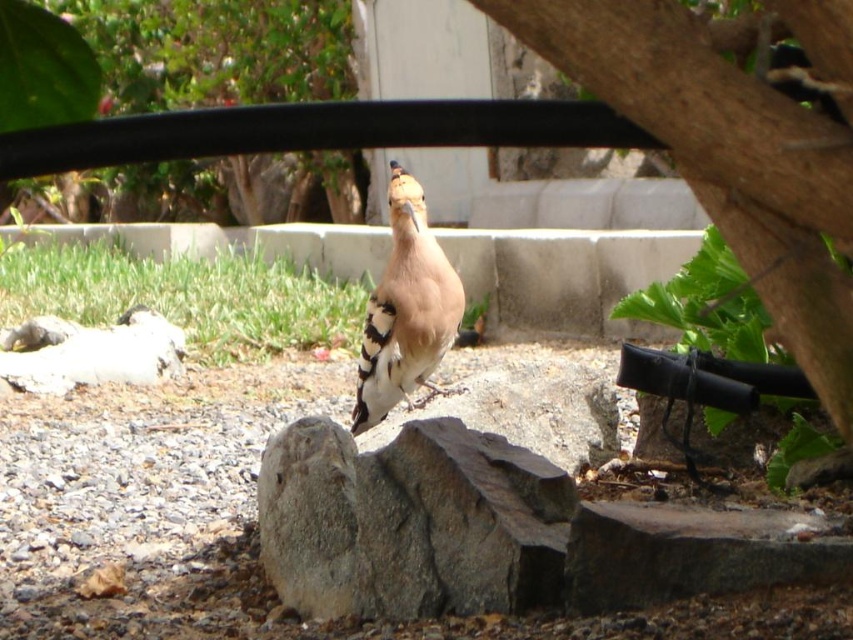
Question: Is gray rough rock at center thinner than green leafy tree at upper center?

Choices:
 (A) yes
 (B) no

Answer: (A)

Question: Based on their relative distances, which object is farther from the brown rough bark at upper right?

Choices:
 (A) gray gravel at center
 (B) green leafy tree at upper center
 (C) brown speckled feathers at center

Answer: (B)

Question: Does brown rough bark at upper right have a larger size compared to green leafy tree at upper center?

Choices:
 (A) yes
 (B) no

Answer: (B)

Question: Which point appears farthest from the camera in this image?

Choices:
 (A) coord(318,211)
 (B) coord(132,493)
 (C) coord(442,257)

Answer: (A)

Question: Is gray gravel at center positioned at the back of green leafy tree at upper center?

Choices:
 (A) no
 (B) yes

Answer: (A)

Question: Which of the following is the closest to the observer?

Choices:
 (A) (422, 435)
 (B) (770, 136)
 (C) (433, 282)
 (D) (0, 582)

Answer: (B)